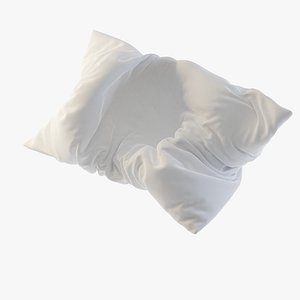
You are a GUI agent. You are given a task and a screenshot of the screen. Output one action in this format:
    pyautogui.click(x=<x>, y=<y>)
    Task: Click on the pillow
    
    Given the screenshot: What is the action you would take?
    pyautogui.click(x=160, y=115)